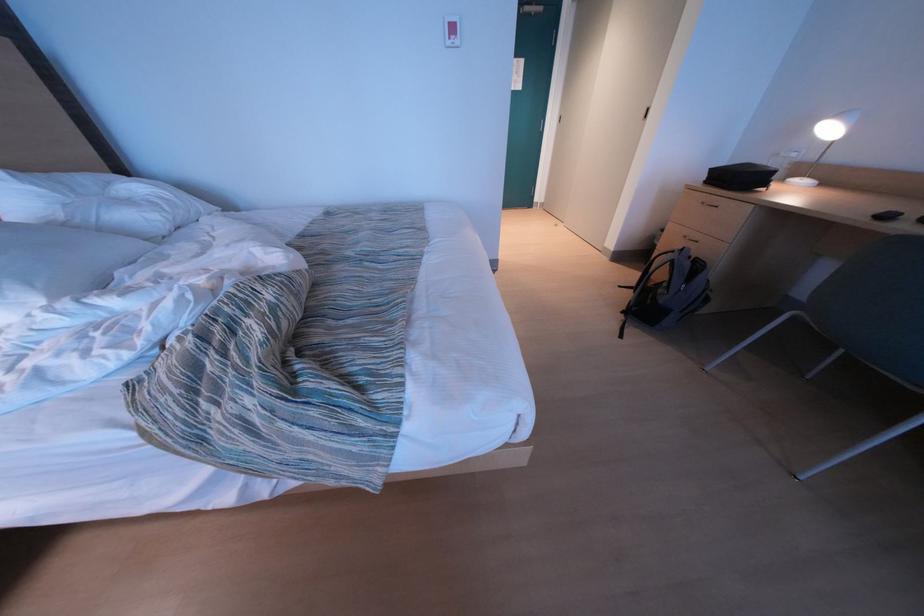
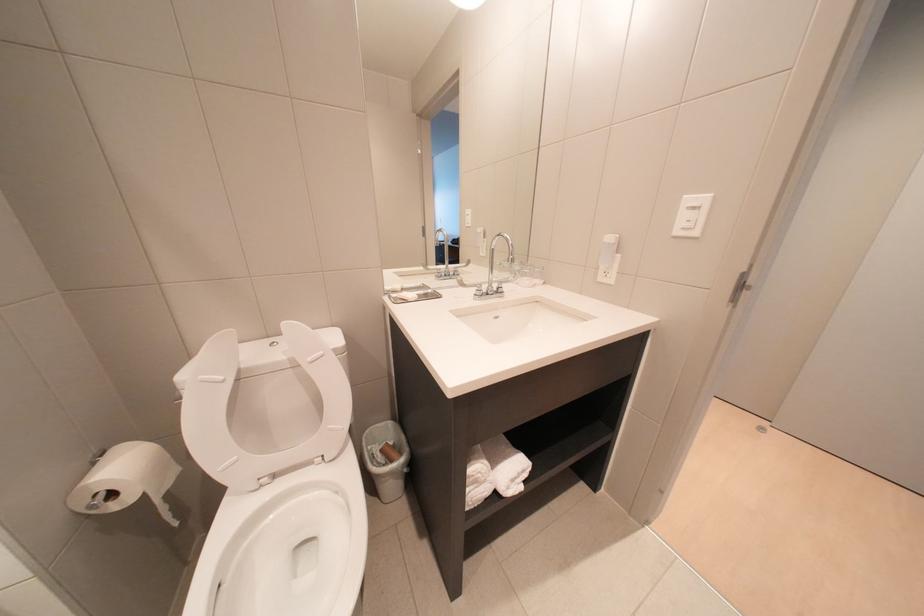
Which direction would the cameraman need to move to produce the second image?

The cameraman walked toward left, forward.